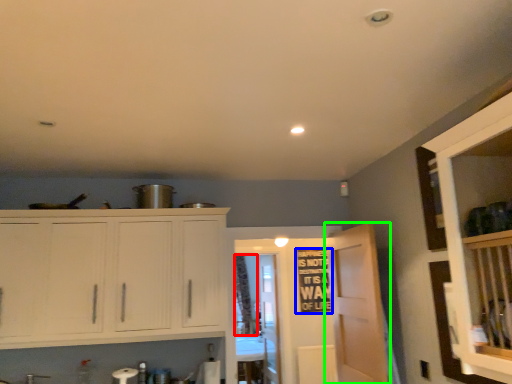
Question: Which is farther away from curtain (highlighted by a red box)? bulletin board (highlighted by a blue box) or door (highlighted by a green box)?

Choices:
 (A) bulletin board
 (B) door

Answer: (B)